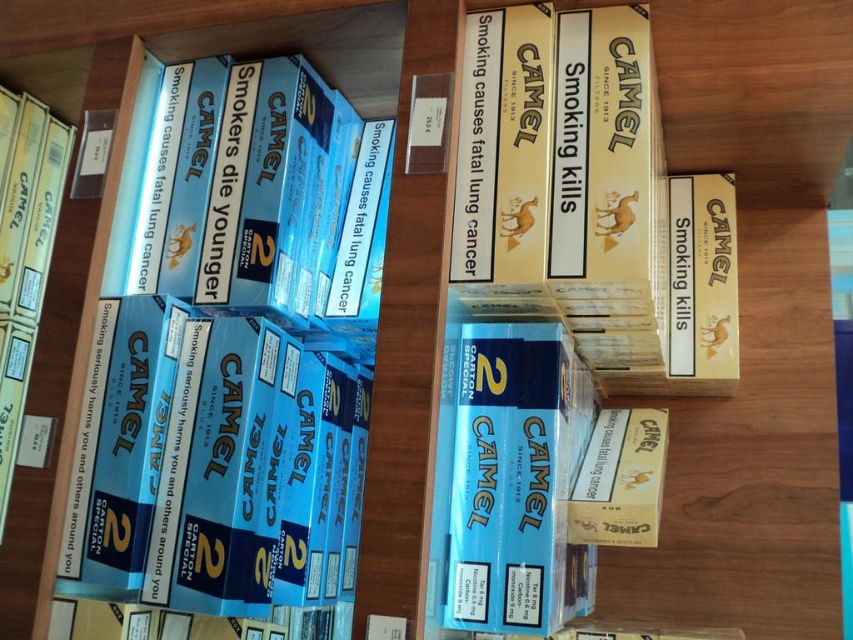
Between matte cardboard book at lower left and matte yellow cardboard at center, which one is positioned higher?

matte cardboard book at lower left is above.

Based on the photo, can you confirm if matte cardboard book at lower left is shorter than matte yellow cardboard at center?

Incorrect, matte cardboard book at lower left's height does not fall short of matte yellow cardboard at center's.

At what (x,y) coordinates should I click in order to perform the action: click on matte cardboard book at lower left. Please return your answer as a coordinate pair (x, y). Looking at the image, I should click on (25, 262).

Is blue cardboard box at left taller than matte yellow cardboard at center?

Indeed, blue cardboard box at left has a greater height compared to matte yellow cardboard at center.

Between point (177, 68) and point (634, 470), which one is positioned behind?

Positioned behind is point (177, 68).

In order to click on blue cardboard box at left in this screenshot , I will do `click(229, 346)`.

Which is more to the right, blue cardboard pack at center or matte cardboard book at lower left?

blue cardboard pack at center is more to the right.

Find the location of a particular element. blue cardboard pack at center is located at coordinates (509, 476).

I want to click on blue cardboard pack at center, so click(x=509, y=476).